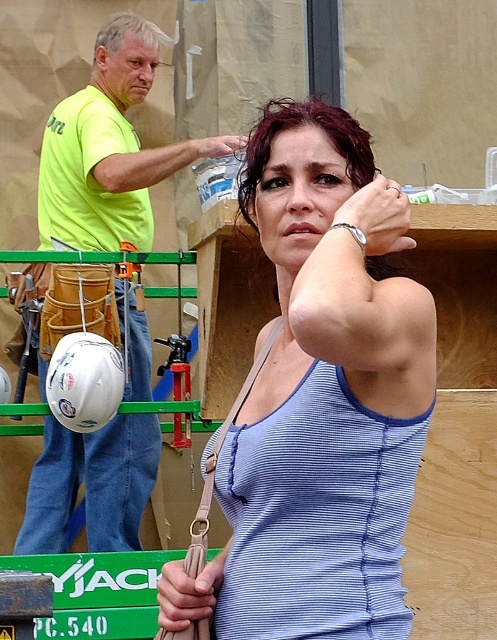
You are standing at the construction site and want to know which of the two points, point (291, 513) or point (77, 460), is nearer to you. Based on the image, which one is closer?

Point (291, 513) is closer to the camera than point (77, 460), so it is the nearer one.